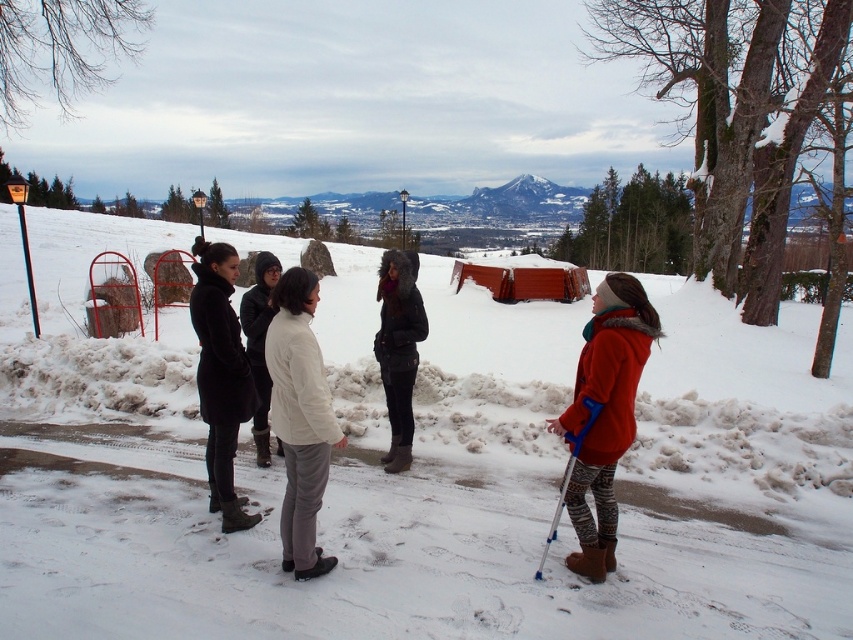
You are planning to ski down the white snow ski slope at center. From your current position, which direction should you face to start skiing down the slope?

The white snow ski slope at center is located at point (421, 472), so you should face the direction of the slope to start skiing down.

You are a photographer trying to capture a clear image of the white woolen coat at center without the white snow ski slope at center overlapping it. How can you adjust your position to achieve this?

The white snow ski slope at center is positioned over the white woolen coat at center. To avoid overlap, move your camera position lower or shift sideways so the ski slope no longer covers the coat.

You are standing in the snowy landscape and want to walk from point A to point B. Point A is at coordinate point(524, 420) and point B is at coordinate point(259, 419). Which point is closer to you?

Point B at coordinate point(259, 419) is closer to you because it is closer to the camera than point A at coordinate point(524, 420).